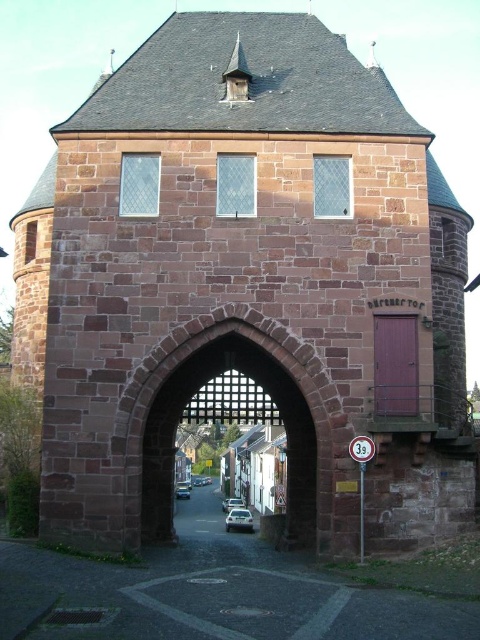
Question: Can you confirm if brown stone alley at center is positioned to the right of reddish stone archway at center?

Choices:
 (A) yes
 (B) no

Answer: (B)

Question: Which object is the farthest from the matte wood door at center-right?

Choices:
 (A) silver metallic car at center
 (B) shiny silver car at center
 (C) reddish stone archway at center
 (D) brown stone alley at center

Answer: (B)

Question: Which of the following is the farthest from the observer?

Choices:
 (A) (173, 573)
 (B) (251, 522)
 (C) (302, 358)

Answer: (B)

Question: Which point appears closest to the camera in this image?

Choices:
 (A) (226, 522)
 (B) (230, 504)
 (C) (375, 384)

Answer: (C)

Question: Is matte wood door at center-right closer to camera compared to silver metallic car at center?

Choices:
 (A) no
 (B) yes

Answer: (B)

Question: Considering the relative positions of reddish stone archway at center and shiny silver car at center in the image provided, where is reddish stone archway at center located with respect to shiny silver car at center?

Choices:
 (A) above
 (B) below

Answer: (A)